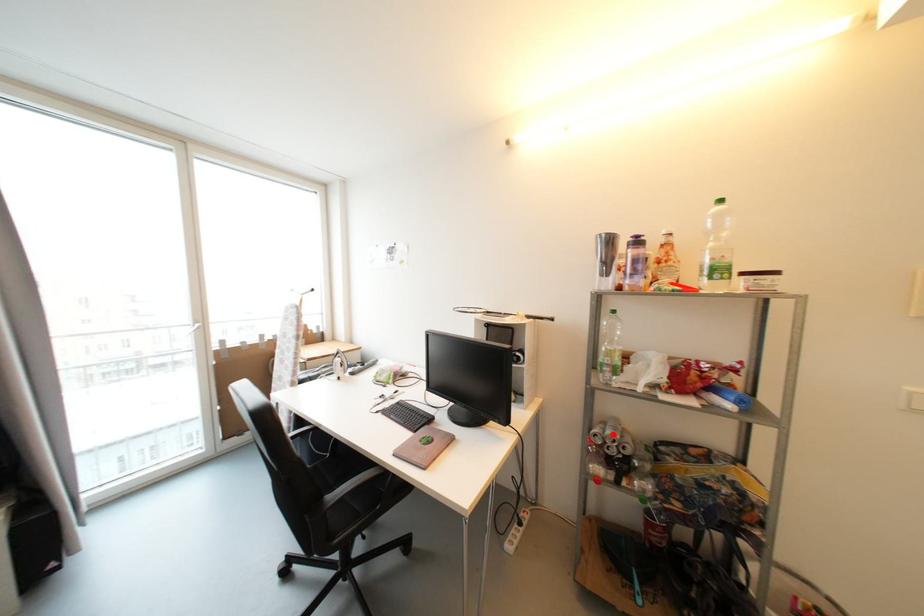
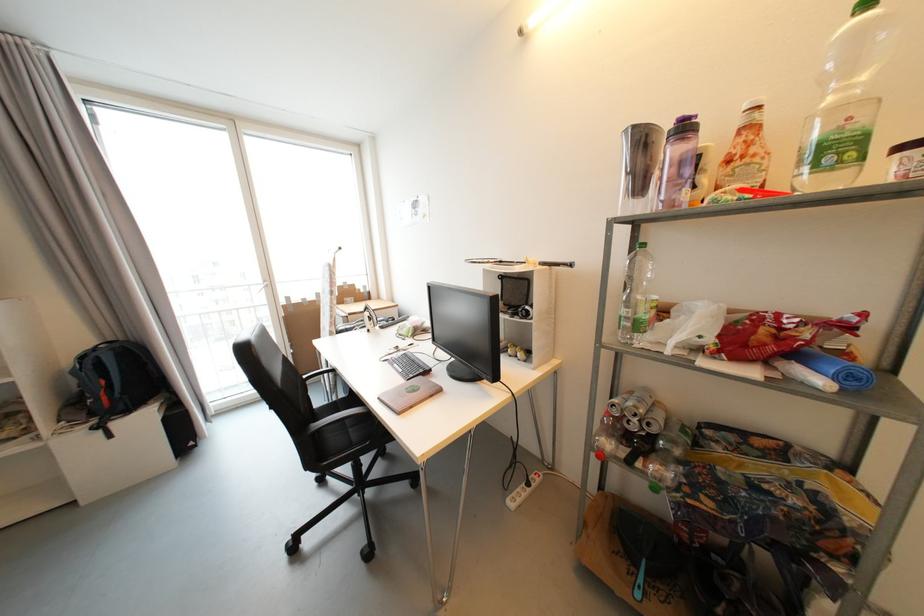
Question: I am providing you with two images of the same scene from different viewpoints. A red point is marked on the first image. Can you still see the location of the red point in image 2?

Choices:
 (A) Yes
 (B) No

Answer: (A)